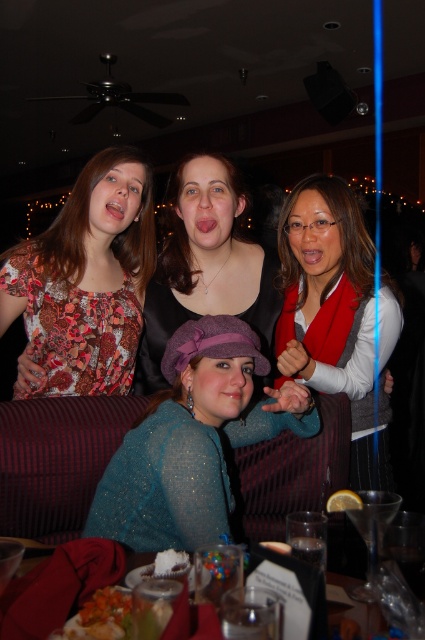
Question: Does sparkly teal sweater at center come in front of matte red scarf at center?

Choices:
 (A) yes
 (B) no

Answer: (A)

Question: Which point is closer to the camera?

Choices:
 (A) (130, 333)
 (B) (141, 378)
 (C) (207, 476)
 (D) (280, 269)

Answer: (C)

Question: Does matte red scarf at center have a greater width compared to matte floral blouse at upper left?

Choices:
 (A) no
 (B) yes

Answer: (A)

Question: Which object is farther from the camera taking this photo?

Choices:
 (A) matte black top at center
 (B) matte floral blouse at upper left
 (C) sparkly teal sweater at center

Answer: (A)

Question: Does sparkly teal sweater at center come behind matte black top at center?

Choices:
 (A) no
 (B) yes

Answer: (A)

Question: Among these objects, which one is farthest from the camera?

Choices:
 (A) matte floral blouse at upper left
 (B) matte black top at center

Answer: (B)